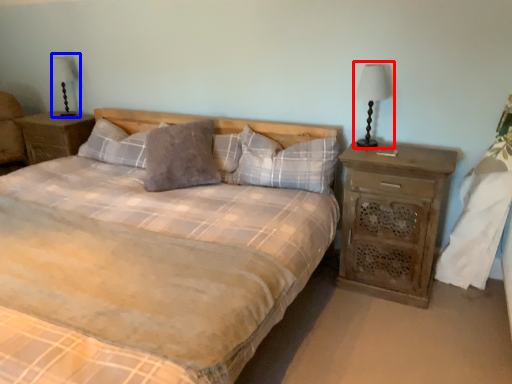
Question: Among these objects, which one is nearest to the camera, bedside lamp (highlighted by a red box) or table lamp (highlighted by a blue box)?

Choices:
 (A) bedside lamp
 (B) table lamp

Answer: (A)